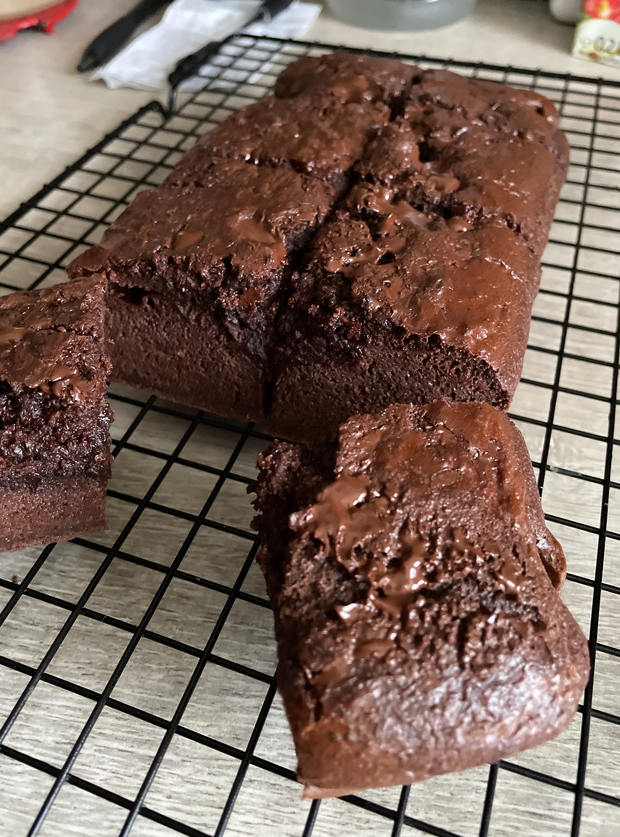
The height and width of the screenshot is (837, 620). I want to click on black cooking rack, so click(76, 608), click(210, 644), click(603, 531), click(599, 80), click(140, 111).